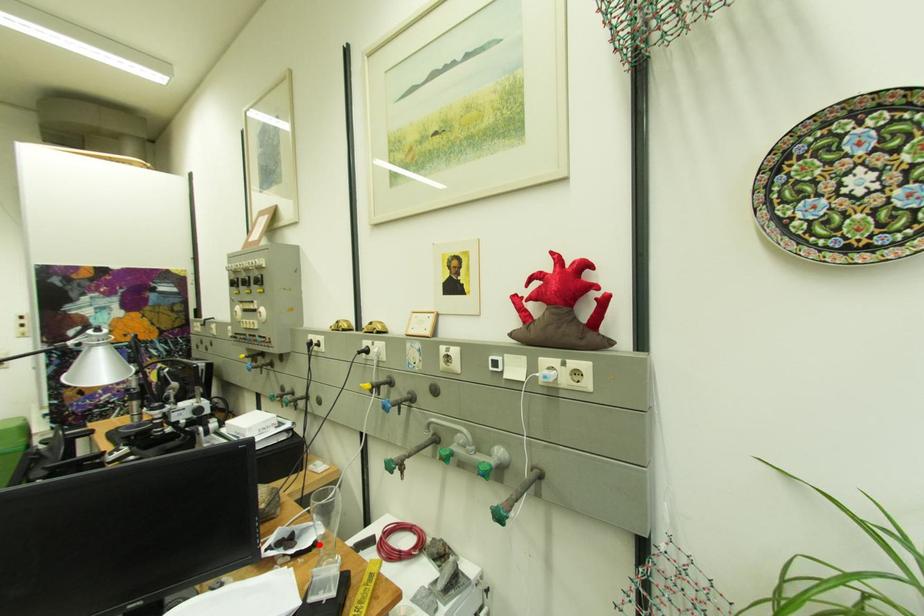
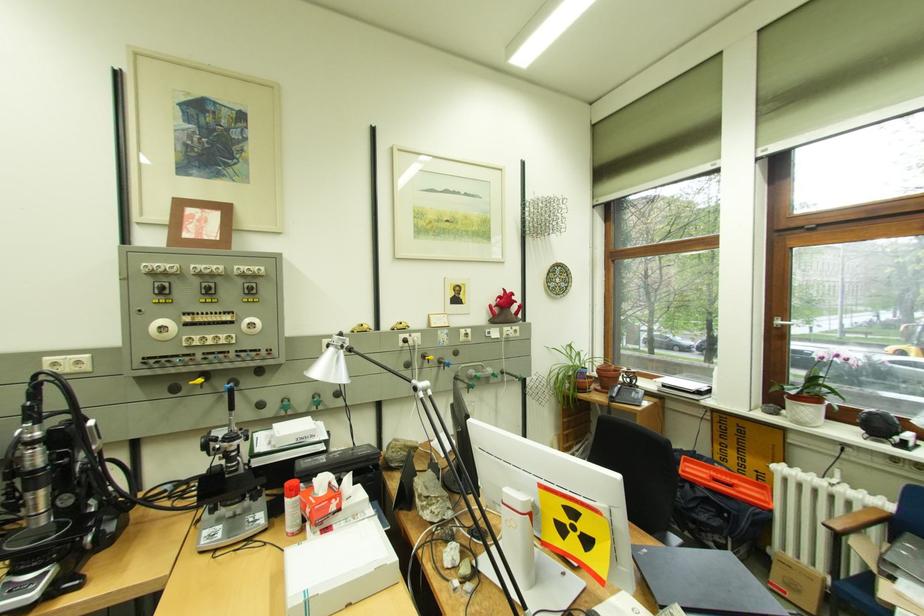
Question: I am providing you with two images of the same scene from different viewpoints. A red point is marked on the first image. Is the red point's position out of view in image 2?

Choices:
 (A) Yes
 (B) No

Answer: (A)